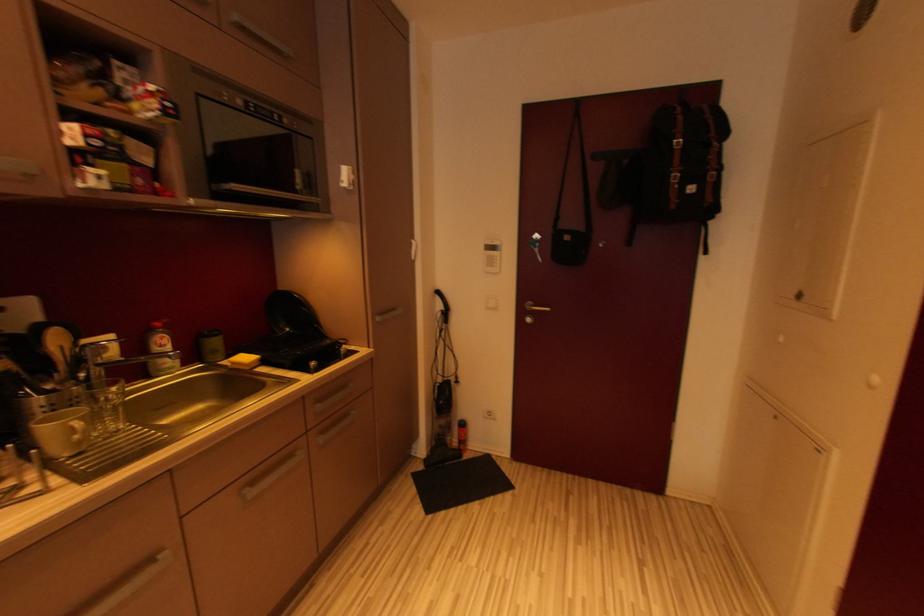
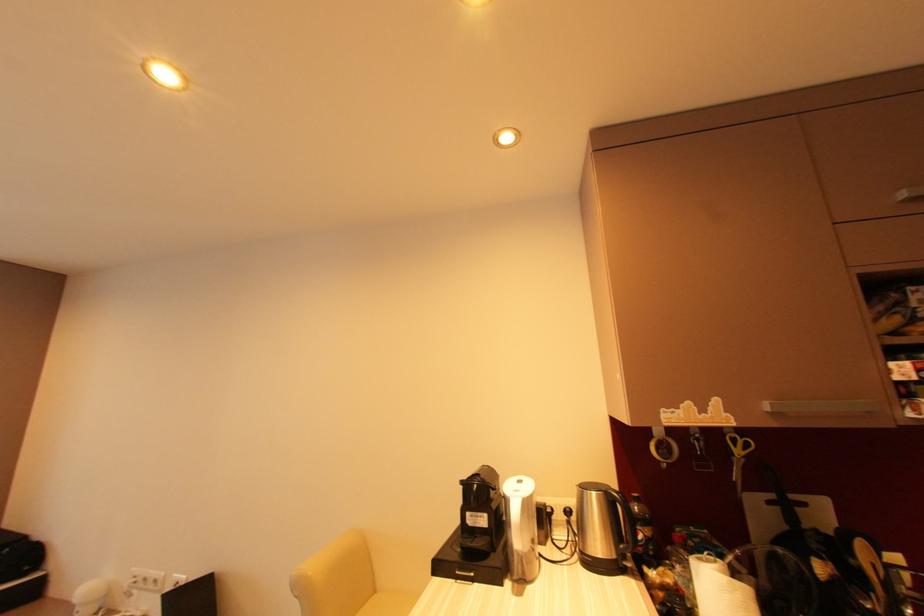
The images are taken continuously from a first-person perspective. In which direction is your viewpoint rotating?

The camera rotated toward left-up.